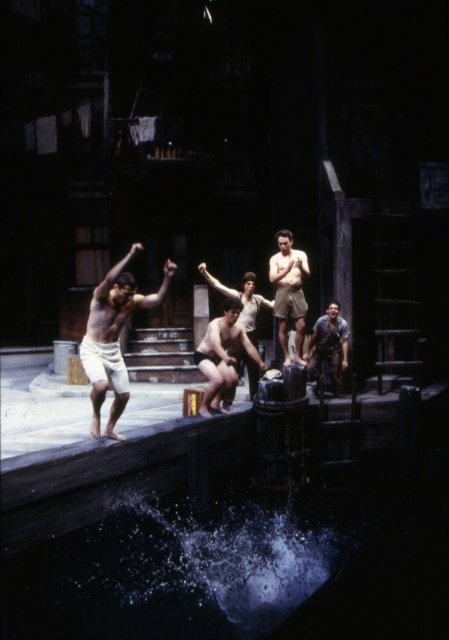
Question: Among these points, which one is nearest to the camera?

Choices:
 (A) (313, 332)
 (B) (221, 330)

Answer: (B)

Question: Where is smooth white shorts at center located in relation to smooth skin man at center in the image?

Choices:
 (A) left
 (B) right

Answer: (A)

Question: Which of the following is the closest to the observer?

Choices:
 (A) clear liquid water at lower center
 (B) rusty metal man at center
 (C) smooth skin man at center
 (D) smooth beige shorts at center

Answer: (A)

Question: Is smooth white shorts at center to the right of smooth beige shorts at center from the viewer's perspective?

Choices:
 (A) yes
 (B) no

Answer: (B)

Question: Estimate the real-world distances between objects in this image. Which object is closer to the smooth white shorts at center?

Choices:
 (A) smooth skin man at center
 (B) clear liquid water at lower center
 (C) rusty metal man at center
 (D) smooth beige shorts at center

Answer: (A)

Question: Is clear liquid water at lower center to the right of smooth beige shorts at center from the viewer's perspective?

Choices:
 (A) yes
 (B) no

Answer: (B)